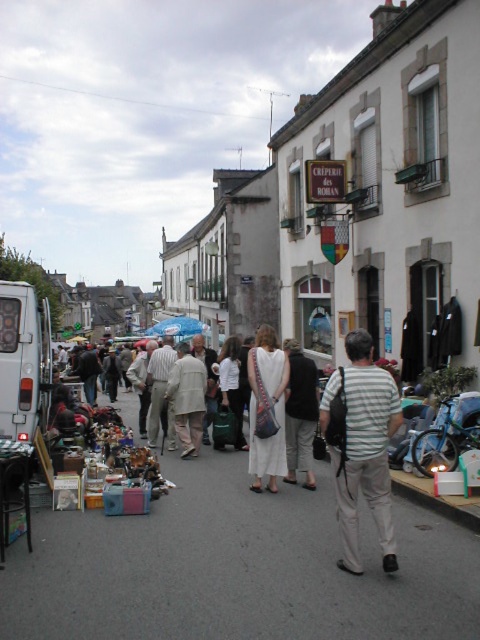
Between matte white van at left and white cotton dress at center, which one has more height?

With more height is white cotton dress at center.

Find the location of `matte white van at left`. matte white van at left is located at coordinates (24, 360).

Who is higher up, white fabric dress at center or white cotton dress at center?

white fabric dress at center

Which of these two, white fabric dress at center or white cotton dress at center, stands taller?

Standing taller between the two is white fabric dress at center.

Between point (250, 412) and point (309, 483), which one is positioned in front?

Point (309, 483) is in front.

Locate an element on the screen. The width and height of the screenshot is (480, 640). white fabric dress at center is located at coordinates (266, 403).

Based on the photo, between striped cotton shirt at center and light beige fabric coat at center, which one is positioned higher?

striped cotton shirt at center is above.

The width and height of the screenshot is (480, 640). Identify the location of striped cotton shirt at center. (361, 445).